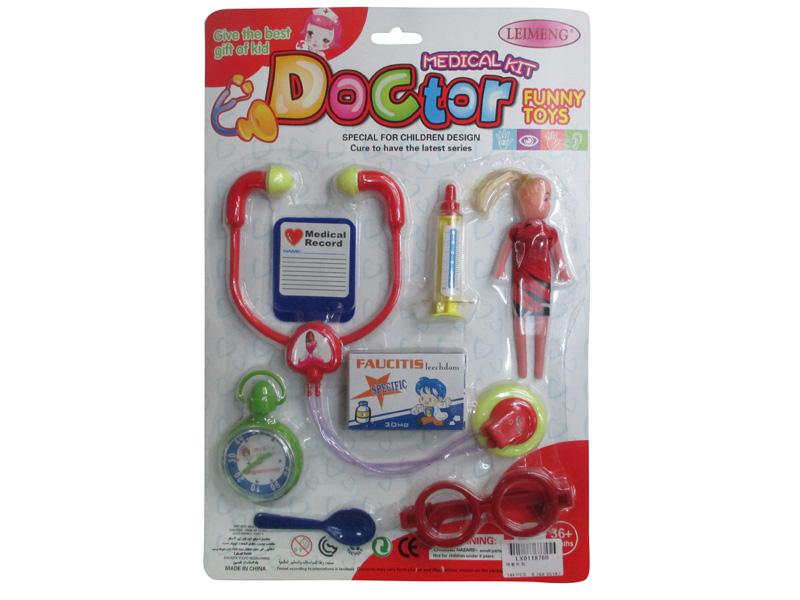
Locate an element on the screen. spoon is located at coordinates (366, 520).